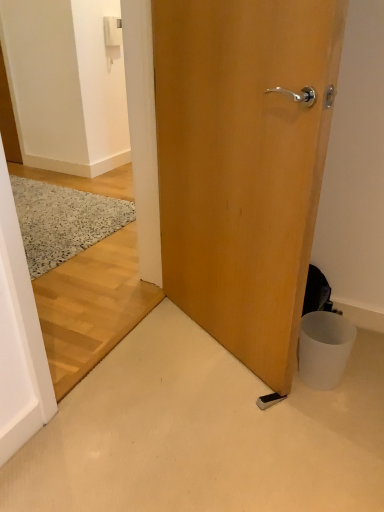
Question: Is white matte trash bin at lower right facing away from speckled wool doormat at left?

Choices:
 (A) no
 (B) yes

Answer: (A)

Question: From the image's perspective, is white matte trash bin at lower right under speckled wool doormat at left?

Choices:
 (A) yes
 (B) no

Answer: (A)

Question: Are white matte trash bin at lower right and speckled wool doormat at left far apart?

Choices:
 (A) yes
 (B) no

Answer: (A)

Question: Is white matte trash bin at lower right outside of speckled wool doormat at left?

Choices:
 (A) no
 (B) yes

Answer: (B)

Question: Does white matte trash bin at lower right turn towards speckled wool doormat at left?

Choices:
 (A) yes
 (B) no

Answer: (B)

Question: Relative to white matte trash bin at lower right, is wooden door at center in front or behind?

Choices:
 (A) front
 (B) behind

Answer: (A)

Question: Does point (261, 185) appear closer or farther from the camera than point (337, 330)?

Choices:
 (A) farther
 (B) closer

Answer: (B)

Question: From the image's perspective, relative to white matte trash bin at lower right, is wooden door at center above or below?

Choices:
 (A) above
 (B) below

Answer: (A)

Question: From a real-world perspective, is wooden door at center above or below white matte trash bin at lower right?

Choices:
 (A) below
 (B) above

Answer: (B)

Question: Is speckled wool doormat at left taller or shorter than wooden door at center?

Choices:
 (A) short
 (B) tall

Answer: (A)

Question: Would you say speckled wool doormat at left is to the left or to the right of wooden door at center in the picture?

Choices:
 (A) left
 (B) right

Answer: (A)

Question: Is point (74, 217) closer or farther from the camera than point (301, 83)?

Choices:
 (A) farther
 (B) closer

Answer: (A)

Question: In terms of width, does speckled wool doormat at left look wider or thinner when compared to wooden door at center?

Choices:
 (A) wide
 (B) thin

Answer: (A)

Question: From a real-world perspective, is white matte trash bin at lower right physically located above or below white plastic light switch at upper center?

Choices:
 (A) above
 (B) below

Answer: (B)

Question: Is white matte trash bin at lower right taller or shorter than white plastic light switch at upper center?

Choices:
 (A) short
 (B) tall

Answer: (A)